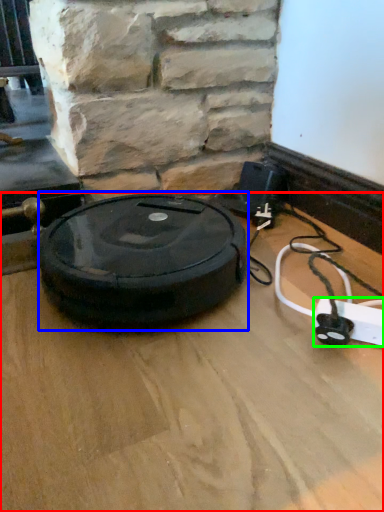
Question: Which object is positioned farthest from surface (highlighted by a red box)? Select from car tire (highlighted by a blue box) and extension cord (highlighted by a green box).

Choices:
 (A) car tire
 (B) extension cord

Answer: (B)